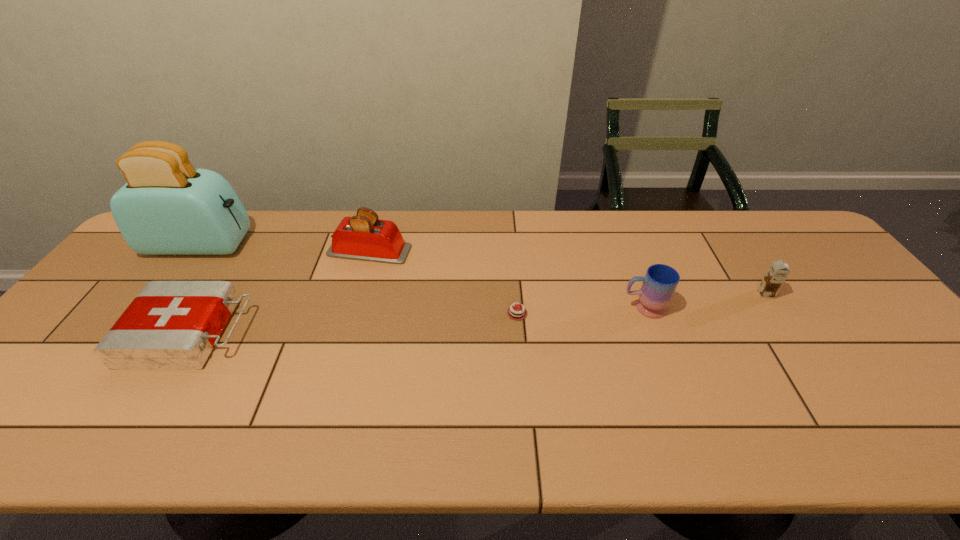
Identify the location of free region at the near edge of the desktop. (531, 424).

Identify the location of free space at the left edge. The image size is (960, 540). (92, 305).

The height and width of the screenshot is (540, 960). Identify the location of vacant area at the right edge. (812, 296).

The image size is (960, 540). In order to click on empty location between the first-aid kit and the chocolate milk in this screenshot , I will do `click(478, 314)`.

The width and height of the screenshot is (960, 540). I want to click on free area in between the chocolate cake and the mug, so click(581, 310).

Where is `empty space that is in between the taller toaster and the rightmost object`? Image resolution: width=960 pixels, height=540 pixels. empty space that is in between the taller toaster and the rightmost object is located at coordinates (483, 269).

The width and height of the screenshot is (960, 540). What are the coordinates of `free space between the right toaster and the chocolate milk` in the screenshot? It's located at (567, 273).

What are the coordinates of `unoccupied area between the second object from right to left and the tallest object` in the screenshot? It's located at (421, 276).

Image resolution: width=960 pixels, height=540 pixels. Identify the location of vacant point located between the tallest object and the rightmost object. (483, 269).

Identify the location of blank region between the mug and the right toaster. click(x=507, y=279).